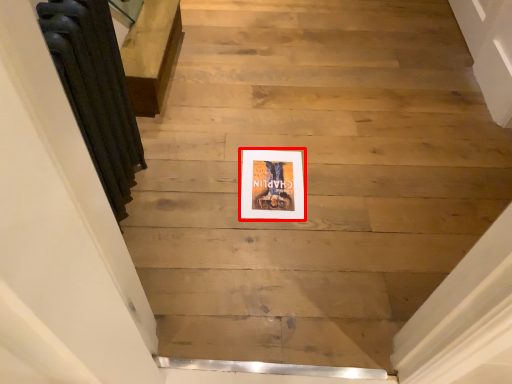
Question: Where is picture frame (annotated by the red box) located in relation to radiator in the image?

Choices:
 (A) right
 (B) left

Answer: (A)